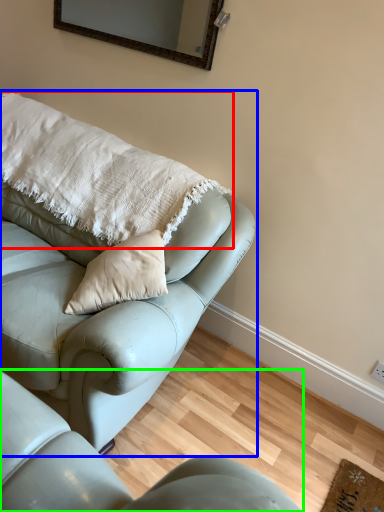
Question: Estimate the real-world distances between objects in this image. Which object is farther from pillow (highlighted by a red box), studio couch (highlighted by a blue box) or studio couch (highlighted by a green box)?

Choices:
 (A) studio couch
 (B) studio couch

Answer: (B)